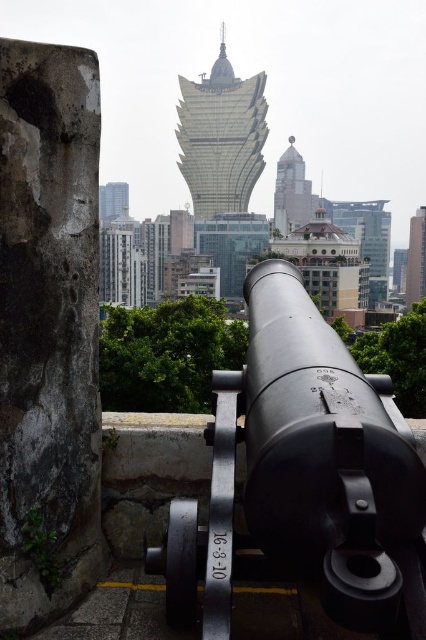
Which is more to the right, smooth gray tower at center or metallic glass tower at right?

metallic glass tower at right is more to the right.

Does point (287, 204) come closer to viewer compared to point (422, 211)?

Yes, it is in front of point (422, 211).

Between point (282, 218) and point (417, 212), which one is positioned behind?

The point (417, 212) is more distant.

Find the location of a particular element. smooth gray tower at center is located at coordinates (290, 192).

Between point (212, 182) and point (302, 209), which one is positioned behind?

The point (302, 209) is behind.

Describe the element at coordinates (221, 136) in the screenshot. I see `gold glass tower at center` at that location.

What do you see at coordinates (221, 136) in the screenshot? This screenshot has width=426, height=640. I see `gold glass tower at center` at bounding box center [221, 136].

At what (x,y) coordinates should I click in order to perform the action: click on gold glass tower at center. Please return your answer as a coordinate pair (x, y). Looking at the image, I should click on (221, 136).

Can you confirm if black matte cannon at center is taller than metallic glass tower at right?

Incorrect, black matte cannon at center's height is not larger of metallic glass tower at right's.

Is black matte cannon at center positioned at the back of metallic glass tower at right?

No, black matte cannon at center is closer to the viewer.

The height and width of the screenshot is (640, 426). What are the coordinates of `black matte cannon at center` in the screenshot? It's located at (302, 477).